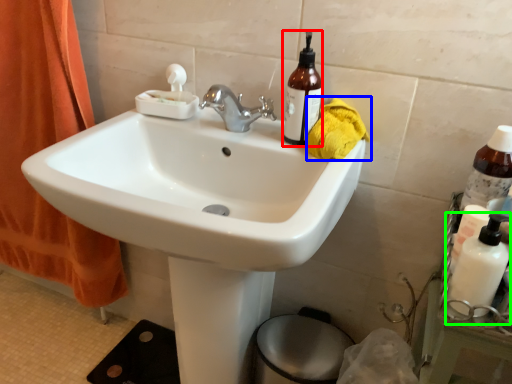
Question: Based on their relative distances, which object is farther from bottle (highlighted by a red box)? Choose from material (highlighted by a blue box) and cleaning product (highlighted by a green box).

Choices:
 (A) material
 (B) cleaning product

Answer: (B)